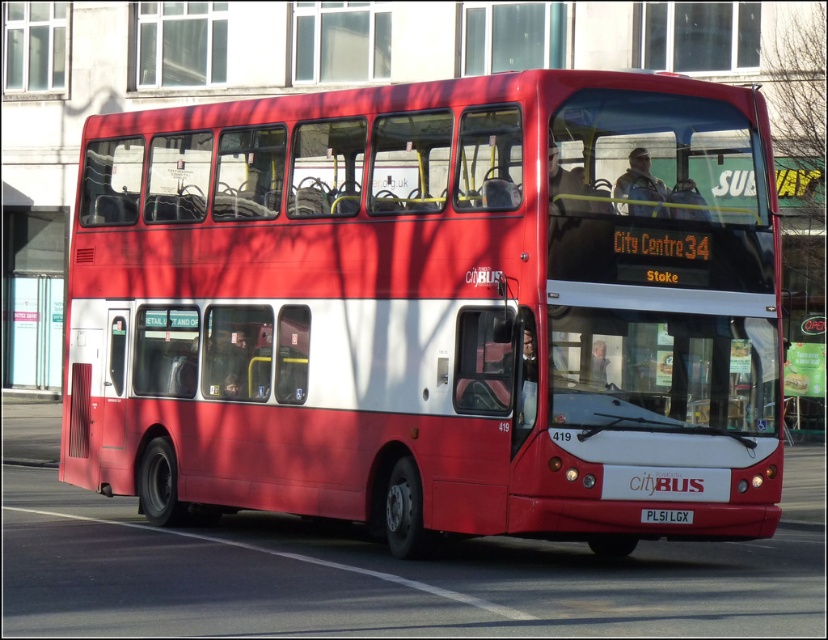
From the picture: You are a photographer trying to capture the matte red bus at center and the black plastic license plate at bottom center in a single frame. Considering their sizes, which object will appear bigger in your photo?

The matte red bus at center appears bigger in the photo because its width is larger than the black plastic license plate at bottom center.

You are a photographer standing at the edge of the street. You want to capture a clear photo of the matte red bus at center. Considering your camera can focus on objects within 10 meters, will you need to adjust your position to get a sharp image?

The matte red bus at center is 10.33 meters away from the camera, which is beyond the camera focus range of 10 meters. To get a sharp image, you need to move closer to the matte red bus at center so it is within 10 meters.

You are standing on the street where the red double decker bus is driving. You see two points marked on the bus, point (x=713, y=298) and point (x=679, y=524). Which point is closer to you?

Point (x=713, y=298) is further to the viewer than point (x=679, y=524), so point (x=679, y=524) is closer to you.